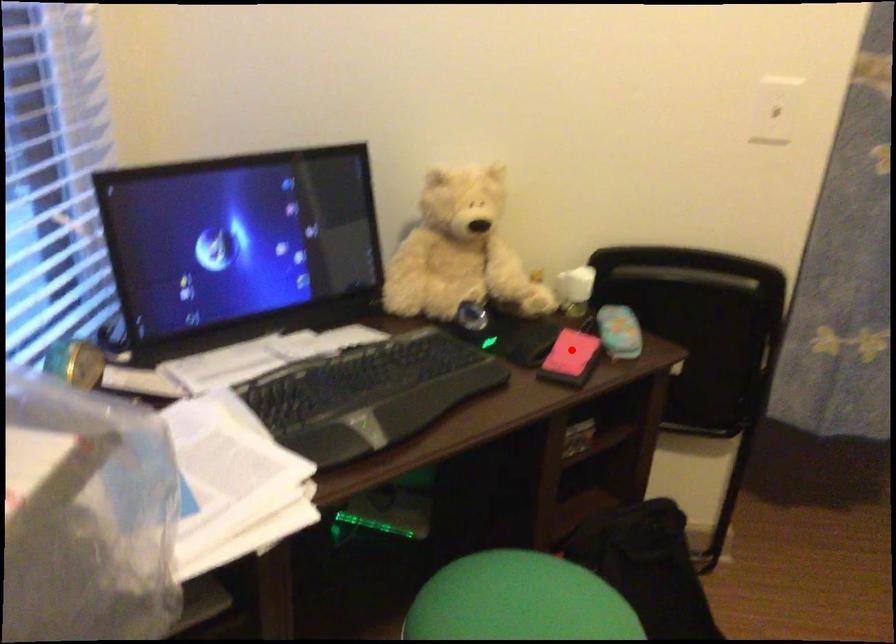
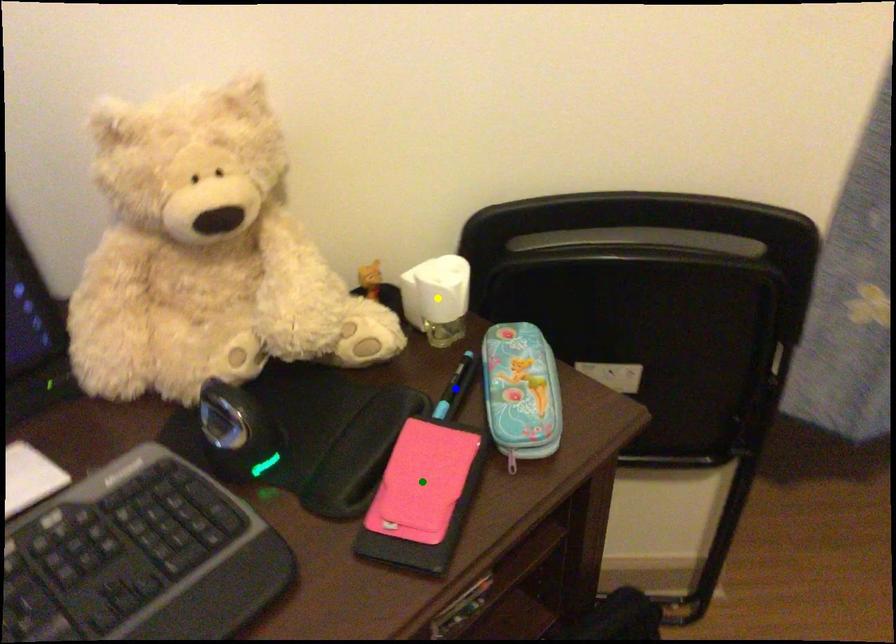
Question: I am providing you with two images of the same scene from different viewpoints. A red point is marked on the first image. You are given multiple points on the second image. Which spot in image 2 lines up with the point in image 1?

Choices:
 (A) yellow point
 (B) blue point
 (C) green point

Answer: (C)